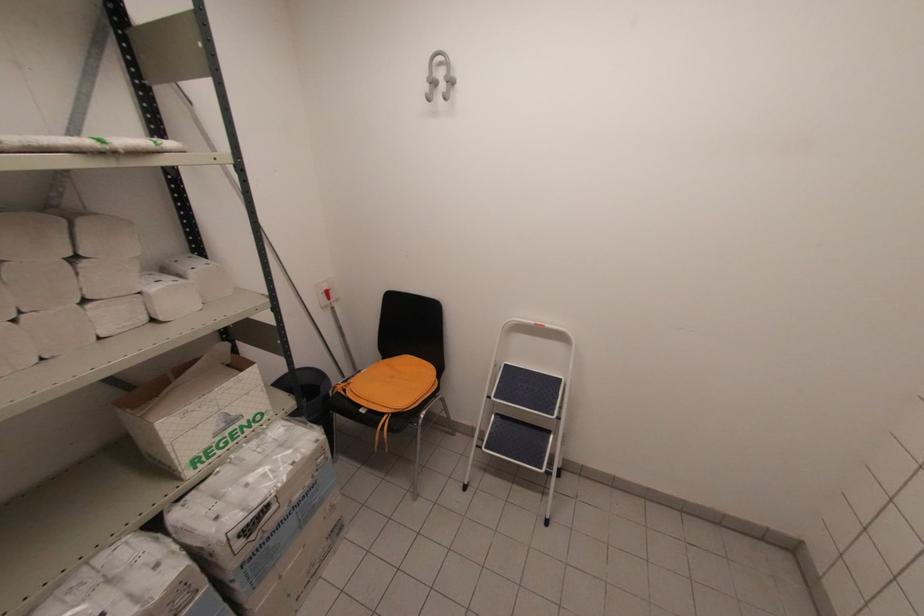
The width and height of the screenshot is (924, 616). Find the location of `red wall switch`. red wall switch is located at coordinates (325, 292).